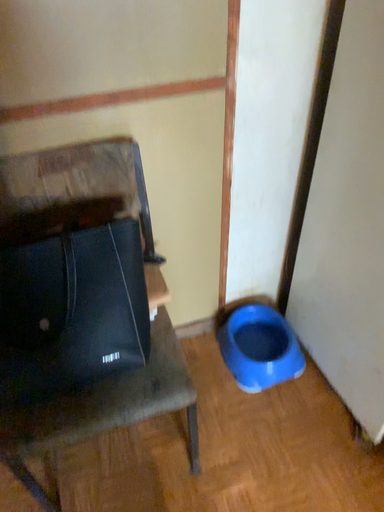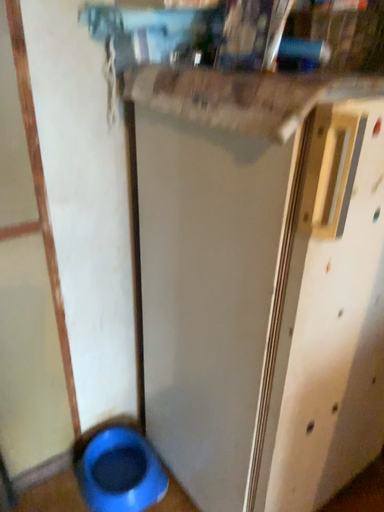
Question: How did the camera likely rotate when shooting the video?

Choices:
 (A) rotated right
 (B) rotated left

Answer: (A)